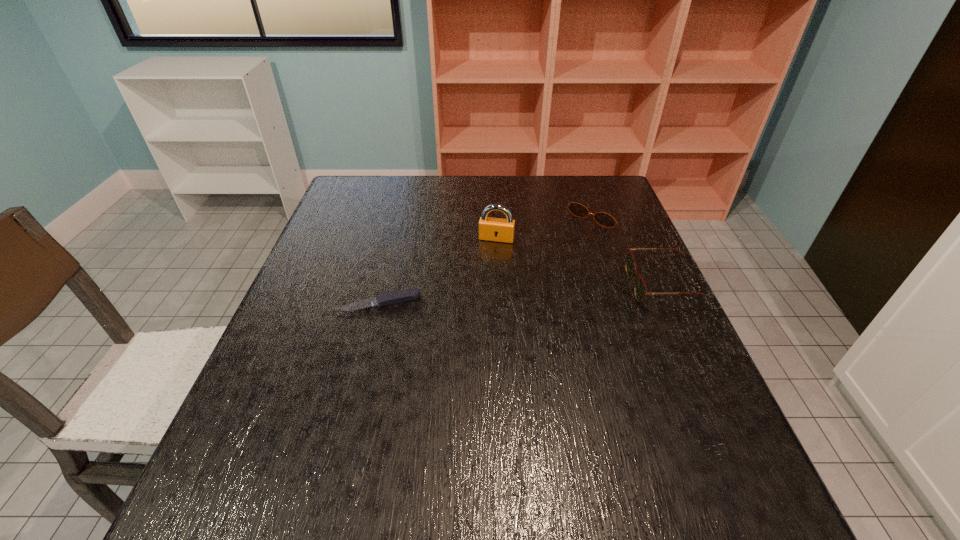
Where is `sunglasses that is at the right edge`? This screenshot has height=540, width=960. sunglasses that is at the right edge is located at coordinates (577, 209).

Locate an element on the screen. The width and height of the screenshot is (960, 540). object positioned at the far right corner is located at coordinates coord(577,209).

The height and width of the screenshot is (540, 960). Identify the location of vacant space at the far edge of the desktop. click(507, 188).

Identify the location of free space at the near edge of the desktop. Image resolution: width=960 pixels, height=540 pixels. (558, 442).

In the image, there is a desktop. Identify the location of free region at the left edge. The height and width of the screenshot is (540, 960). (335, 223).

In the image, there is a desktop. In order to click on vacant space at the right edge in this screenshot , I will do `click(669, 359)`.

Identify the location of free region at the far left corner of the desktop. The width and height of the screenshot is (960, 540). (342, 190).

This screenshot has height=540, width=960. I want to click on vacant region at the far right corner, so click(610, 180).

This screenshot has width=960, height=540. Find the location of `free space between the second object from left to right and the steak knife`. free space between the second object from left to right and the steak knife is located at coordinates (438, 271).

Locate an element on the screen. Image resolution: width=960 pixels, height=540 pixels. unoccupied position between the spectacles and the second object from left to right is located at coordinates (579, 262).